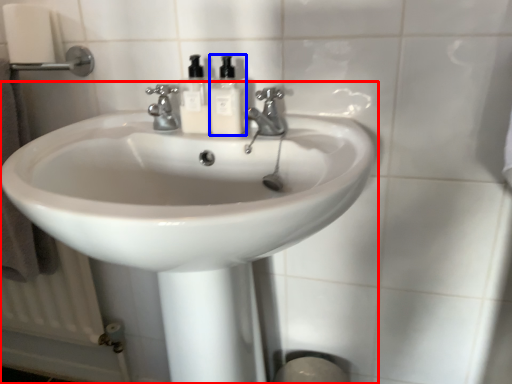
Question: Among these objects, which one is farthest to the camera, sink (highlighted by a red box) or soap dispenser (highlighted by a blue box)?

Choices:
 (A) sink
 (B) soap dispenser

Answer: (B)